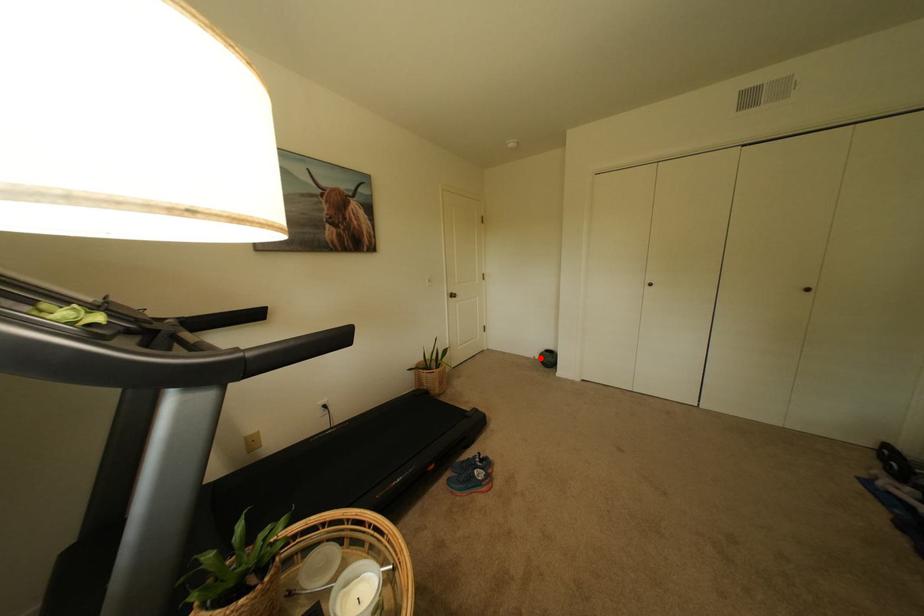
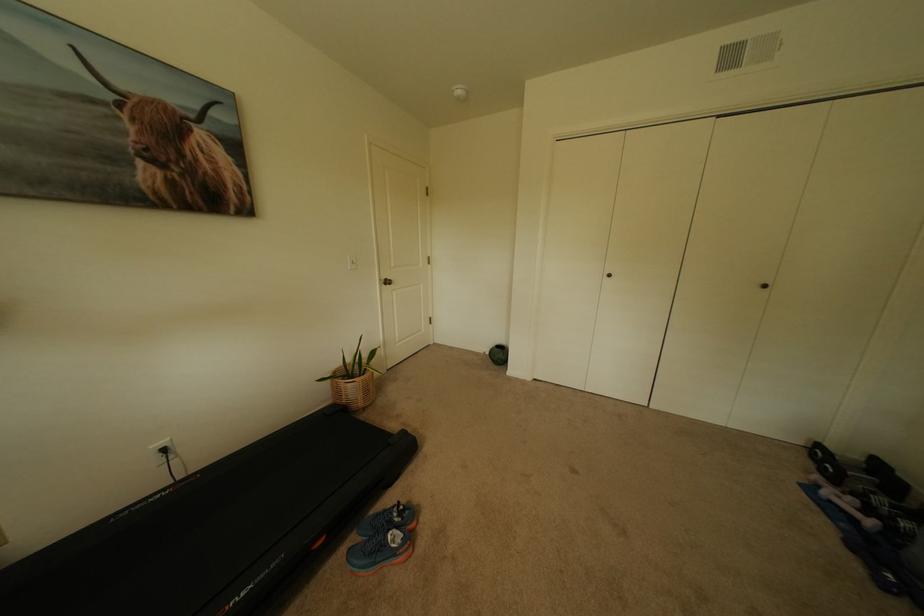
In the second image, find the point that corresponds to the highlighted location in the first image.

(491, 353)